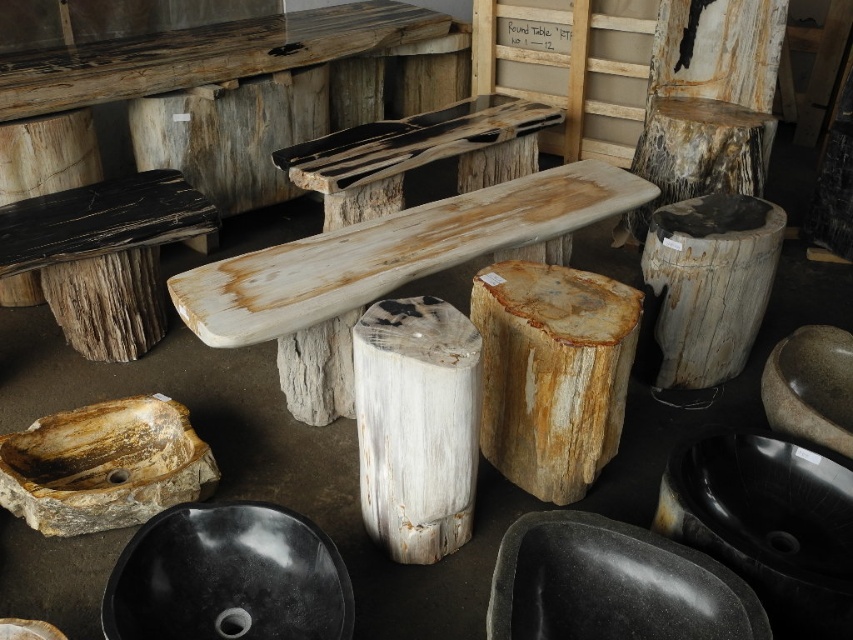
Is the position of natural wood bench at center less distant than that of speckled white wood stump at center?

Yes, it is in front of speckled white wood stump at center.

In order to click on natural wood bench at center in this screenshot , I will do `click(383, 272)`.

Identify the location of natural wood bench at center. The image size is (853, 640). (383, 272).

In the scene shown: Is natural wood bench at center above natural wood stump at center?

Yes.

Does natural wood bench at center come in front of natural wood stump at center?

That is False.

What do you see at coordinates (383, 272) in the screenshot? I see `natural wood bench at center` at bounding box center [383, 272].

At what (x,y) coordinates should I click in order to perform the action: click on natural wood bench at center. Please return your answer as a coordinate pair (x, y). The width and height of the screenshot is (853, 640). Looking at the image, I should click on (383, 272).

In the scene shown: Which of these two, natural wood bench at center or speckled wood stool at center, stands shorter?

Standing shorter between the two is speckled wood stool at center.

In the scene shown: Measure the distance between natural wood bench at center and camera.

The distance of natural wood bench at center from camera is 6.20 feet.

Is point (334, 333) farther from viewer compared to point (668, 134)?

That is False.

The image size is (853, 640). What are the coordinates of `natural wood bench at center` in the screenshot? It's located at (383, 272).